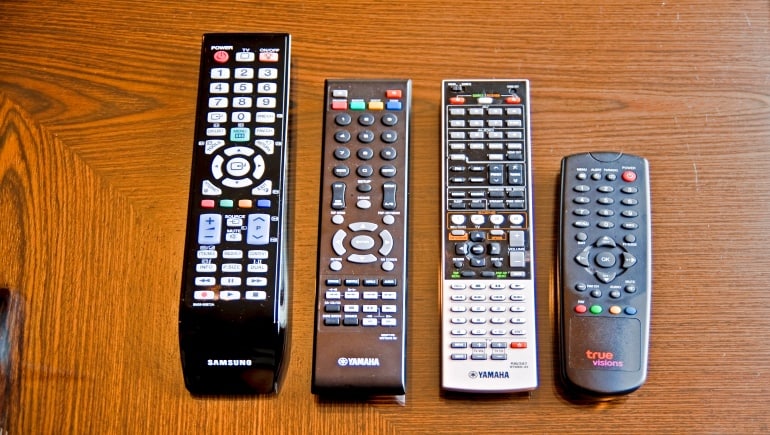
Where is `wooden table top`? Image resolution: width=770 pixels, height=435 pixels. wooden table top is located at coordinates (88, 213).